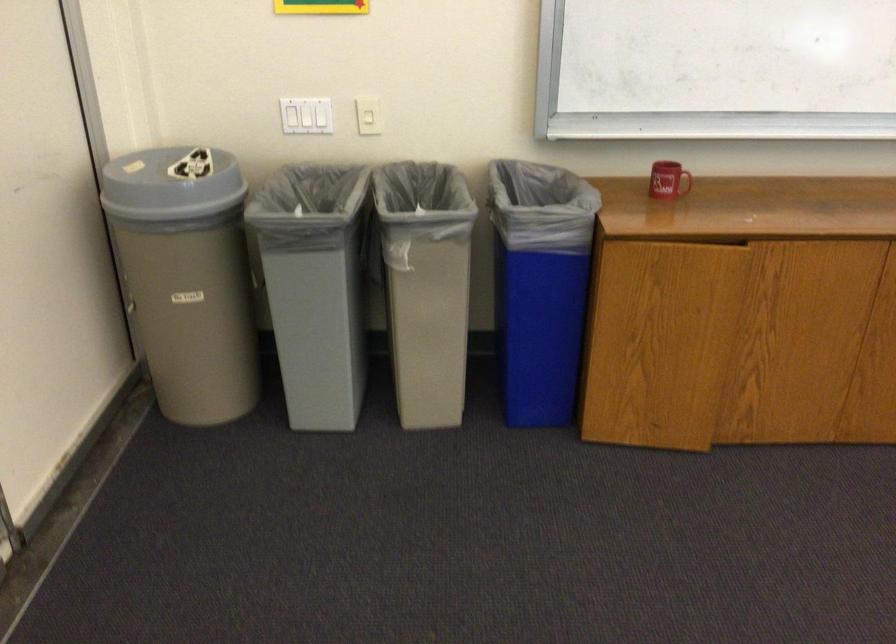
Find the location of `red mug handle`. red mug handle is located at coordinates (664, 180).